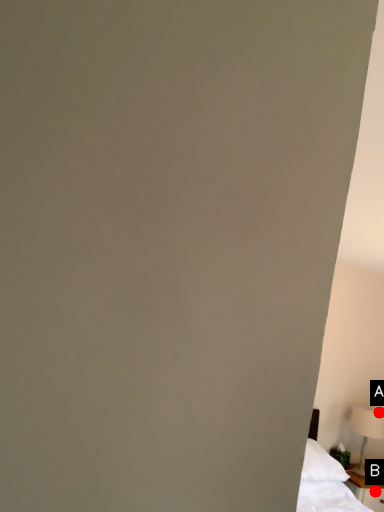
Question: Two points are circled on the image, labeled by A and B beside each circle. Which point is further to the camera?

Choices:
 (A) A is further
 (B) B is further

Answer: (A)